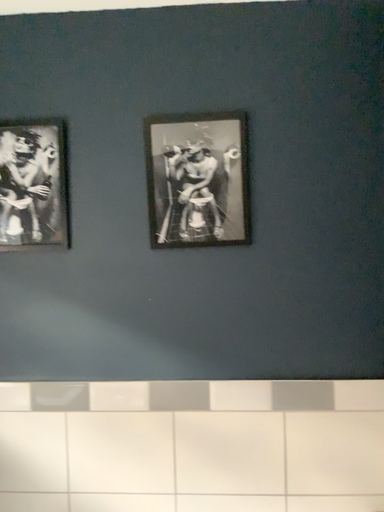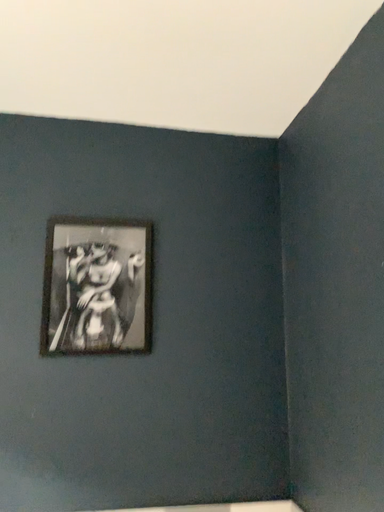
Question: How did the camera likely rotate when shooting the video?

Choices:
 (A) rotated upward
 (B) rotated downward

Answer: (A)